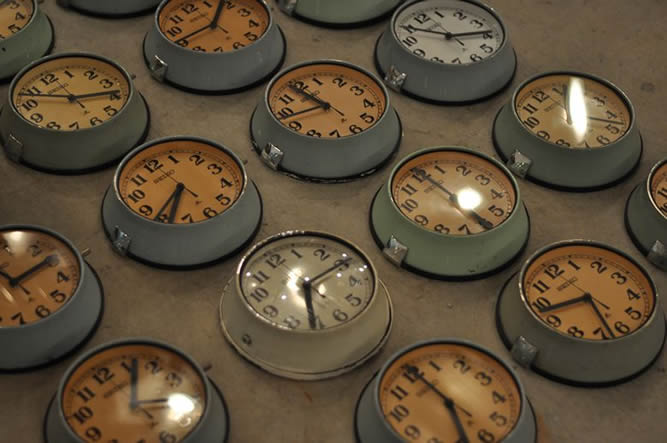
Locate an element on the screen. clock 7 is located at coordinates (356, 129).